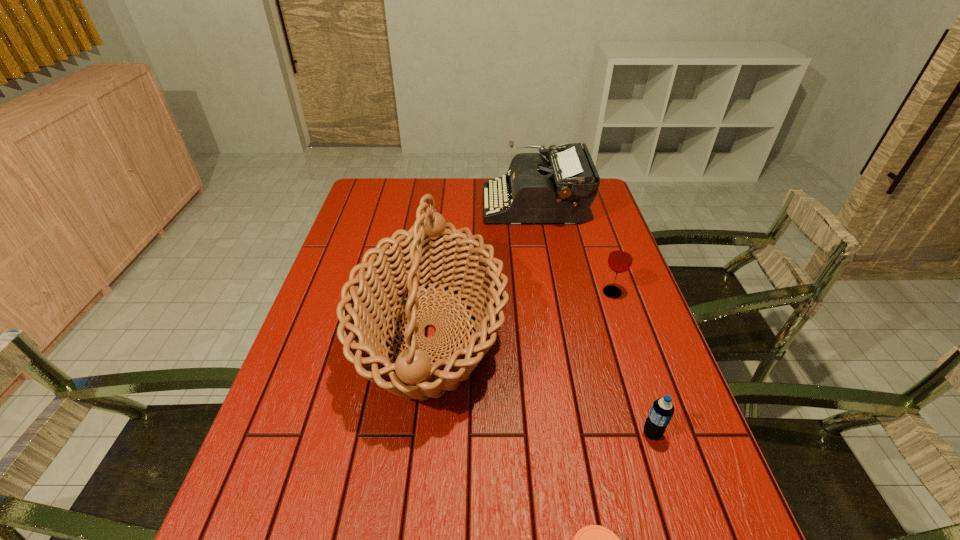
Locate an element on the screen. This screenshot has width=960, height=540. object positioned at the far edge is located at coordinates (561, 190).

This screenshot has height=540, width=960. I want to click on object at the left edge, so click(x=427, y=254).

At what (x,y) coordinates should I click in order to perform the action: click on typewriter located at the right edge. Please return your answer as a coordinate pair (x, y). This screenshot has width=960, height=540. Looking at the image, I should click on (561, 190).

The image size is (960, 540). Find the location of `glass that is at the right edge`. glass that is at the right edge is located at coordinates (620, 259).

The width and height of the screenshot is (960, 540). What are the coordinates of `soda bottle at the right edge` in the screenshot? It's located at (662, 410).

Where is `object located in the far right corner section of the desktop`? This screenshot has width=960, height=540. object located in the far right corner section of the desktop is located at coordinates (561, 190).

Where is `vacant region at the far edge of the desktop`? Image resolution: width=960 pixels, height=540 pixels. vacant region at the far edge of the desktop is located at coordinates (481, 191).

At what (x,y) coordinates should I click in order to perform the action: click on free spot at the left edge of the desktop. Please return your answer as a coordinate pair (x, y). Looking at the image, I should click on (332, 392).

In the image, there is a desktop. At what (x,y) coordinates should I click in order to perform the action: click on vacant space at the right edge. Please return your answer as a coordinate pair (x, y). This screenshot has width=960, height=540. Looking at the image, I should click on (653, 319).

Locate an element on the screen. This screenshot has width=960, height=540. free spot between the glass and the basket is located at coordinates (521, 313).